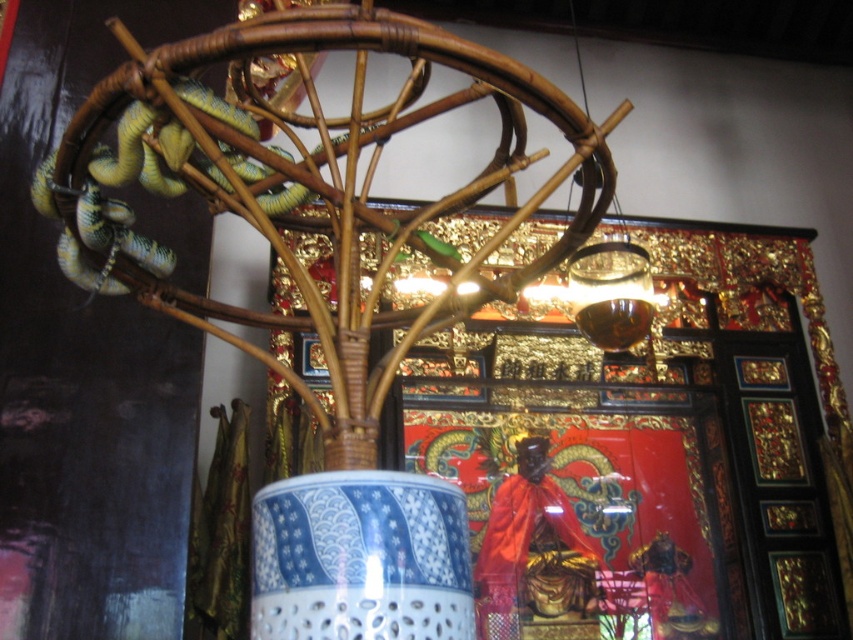
Question: Can you confirm if blue porcelain vase at center is positioned above green glossy snake at upper left?

Choices:
 (A) yes
 (B) no

Answer: (B)

Question: Does blue porcelain vase at center appear over green glossy snake at upper left?

Choices:
 (A) yes
 (B) no

Answer: (B)

Question: Can you confirm if blue porcelain vase at center is thinner than green glossy snake at upper left?

Choices:
 (A) yes
 (B) no

Answer: (A)

Question: Which point is farther to the camera?

Choices:
 (A) blue porcelain vase at center
 (B) green glossy snake at upper left

Answer: (B)